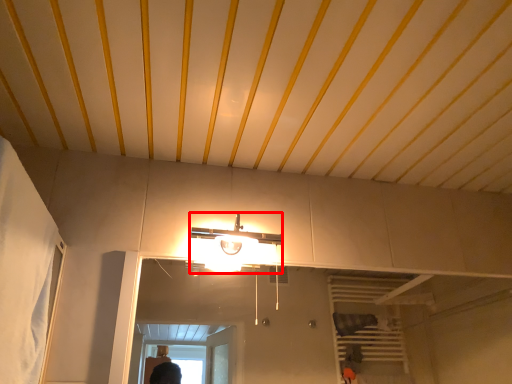
Question: Considering the relative positions of light fixture (annotated by the red box) and curtain in the image provided, where is light fixture (annotated by the red box) located with respect to the staircase?

Choices:
 (A) right
 (B) left

Answer: (A)